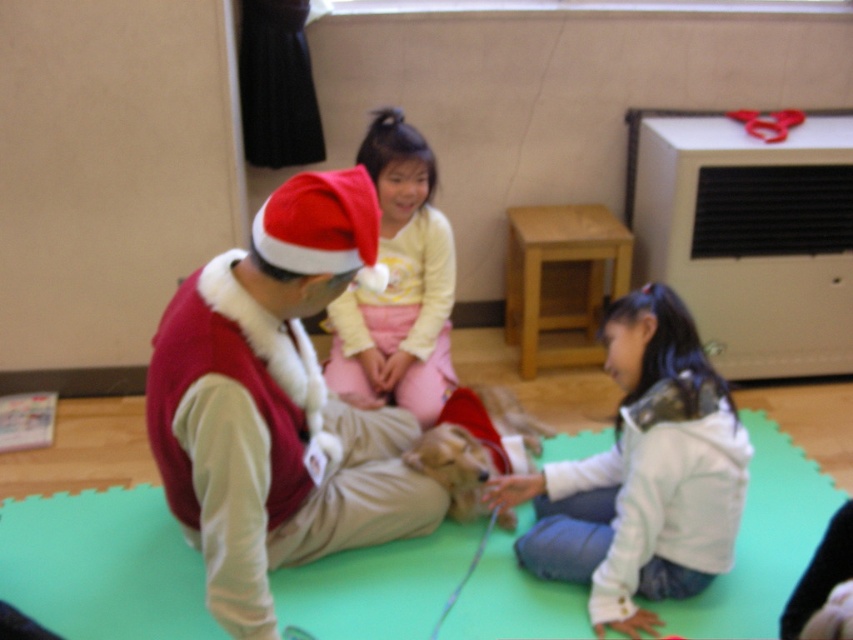
Between fuzzy red vest at center and light yellow fleece shirt at center, which one has less height?

fuzzy red vest at center

Can you confirm if fuzzy red vest at center is thinner than light yellow fleece shirt at center?

No, fuzzy red vest at center is not thinner than light yellow fleece shirt at center.

Where is `fuzzy red vest at center`? The image size is (853, 640). fuzzy red vest at center is located at coordinates (276, 404).

Who is more forward, (641, 563) or (360, 387)?

Point (641, 563) is in front.

Is white fleece jacket at lower right to the right of light yellow fleece shirt at center from the viewer's perspective?

Yes, white fleece jacket at lower right is to the right of light yellow fleece shirt at center.

Is point (653, 365) closer to viewer compared to point (379, 330)?

Yes, point (653, 365) is in front of point (379, 330).

This screenshot has height=640, width=853. What are the coordinates of `white fleece jacket at lower right` in the screenshot? It's located at (642, 474).

Does fuzzy red vest at center have a smaller size compared to white fleece jacket at lower right?

No, fuzzy red vest at center is not smaller than white fleece jacket at lower right.

Is fuzzy red vest at center below white fleece jacket at lower right?

No, fuzzy red vest at center is not below white fleece jacket at lower right.

Which is in front, point (169, 492) or point (556, 508)?

Point (169, 492) is more forward.

This screenshot has width=853, height=640. I want to click on fuzzy red vest at center, so click(276, 404).